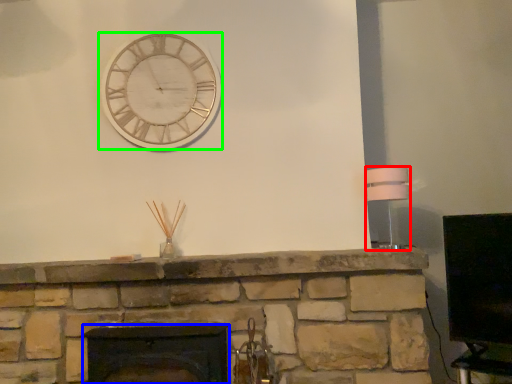
Question: Estimate the real-world distances between objects in this image. Which object is farther from lamp (highlighted by a red box), fireplace (highlighted by a blue box) or wall clock (highlighted by a green box)?

Choices:
 (A) fireplace
 (B) wall clock

Answer: (A)